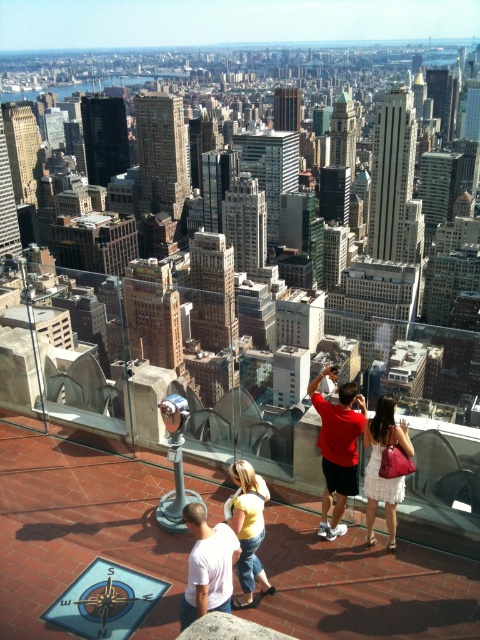
Question: Does matte red shirt at center come in front of white lace dress at center?

Choices:
 (A) no
 (B) yes

Answer: (A)

Question: Is the position of matte red shirt at center more distant than that of white lace dress at center?

Choices:
 (A) no
 (B) yes

Answer: (B)

Question: Estimate the real-world distances between objects in this image. Which object is farther from the yellow cotton shirt at center?

Choices:
 (A) white lace dress at center
 (B) matte red shirt at center

Answer: (A)

Question: Estimate the real-world distances between objects in this image. Which object is closer to the matte red shirt at center?

Choices:
 (A) yellow cotton shirt at center
 (B) white lace dress at center

Answer: (B)

Question: Which point is farther to the camera?

Choices:
 (A) matte red shirt at center
 (B) white lace dress at center

Answer: (A)

Question: Is matte red shirt at center bigger than white lace dress at center?

Choices:
 (A) yes
 (B) no

Answer: (B)